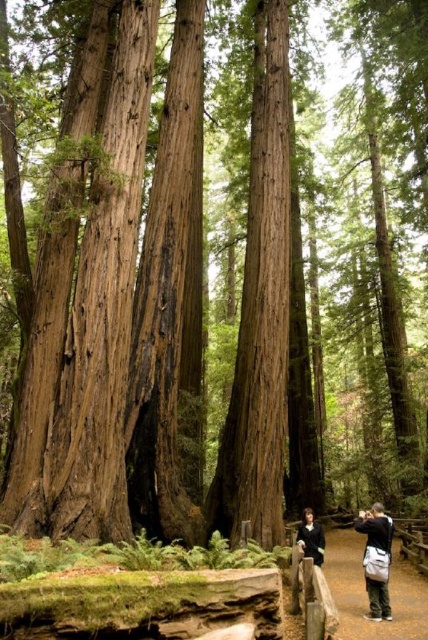
You are a photographer carrying a dark gray fabric camera bag at lower right and want to walk along the brown dirt path at center. Can you step onto the path without moving the camera bag?

The brown dirt path at center is positioned under dark gray fabric camera bag at lower right, so stepping onto the path would require moving the camera bag first.

You are a hiker who wants to take a photo of the brown dirt path at center using your camera bag. Since the dark gray fabric camera bag at lower right is in your way, can you move it to get a clear view?

The brown dirt path at center is in front of the dark gray fabric camera bag at lower right, so the path is already visible without needing to move the camera bag. However, if the camera bag is blocking the view, you might need to adjust your position to ensure the path is fully visible.